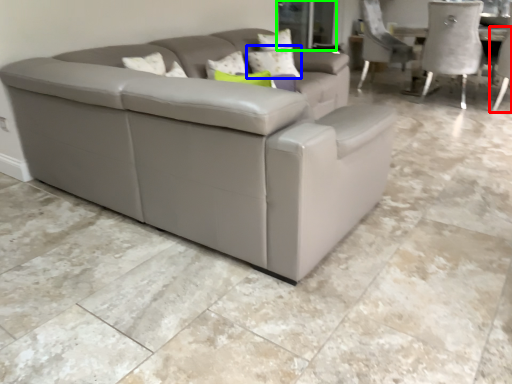
Question: Which object is the farthest from chair (highlighted by a red box)? Choose among these: pillow (highlighted by a blue box) or glass door (highlighted by a green box).

Choices:
 (A) pillow
 (B) glass door

Answer: (A)